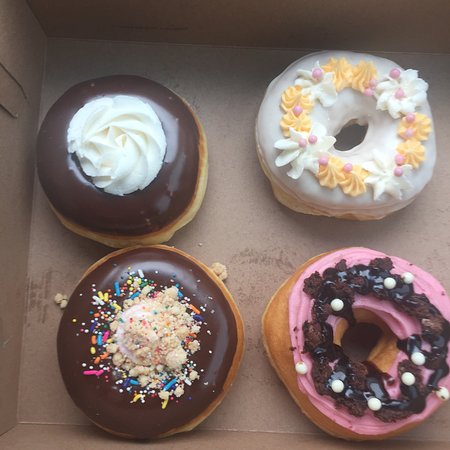
Locate an element on the screen. The width and height of the screenshot is (450, 450). decoration is located at coordinates (105, 149), (128, 327), (336, 367), (350, 179).